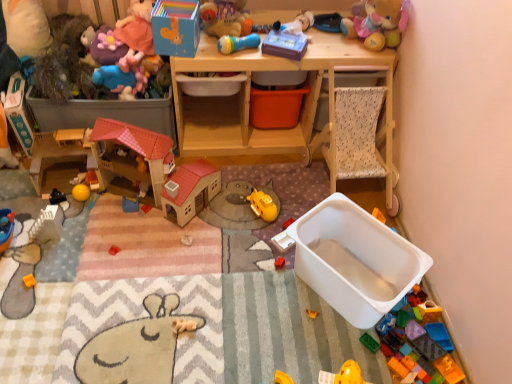
Question: From the image's perspective, is translucent plastic car at lower right, placed as the 1th toy when sorted from right to left, over wooden desk at upper center?

Choices:
 (A) no
 (B) yes

Answer: (A)

Question: Considering the relative sizes of translucent plastic car at lower right, placed as the 12th toy when sorted from left to right, and wooden desk at upper center in the image provided, is translucent plastic car at lower right, placed as the 12th toy when sorted from left to right, shorter than wooden desk at upper center?

Choices:
 (A) no
 (B) yes

Answer: (B)

Question: Are translucent plastic car at lower right, placed as the 1th toy when sorted from right to left, and wooden desk at upper center beside each other?

Choices:
 (A) no
 (B) yes

Answer: (A)

Question: Is translucent plastic car at lower right, placed as the 1th toy when sorted from right to left, closer to camera compared to wooden desk at upper center?

Choices:
 (A) yes
 (B) no

Answer: (A)

Question: Considering the relative sizes of translucent plastic car at lower right, placed as the 12th toy when sorted from left to right, and wooden desk at upper center in the image provided, is translucent plastic car at lower right, placed as the 12th toy when sorted from left to right, smaller than wooden desk at upper center?

Choices:
 (A) no
 (B) yes

Answer: (B)

Question: Is translucent plastic car at lower right, placed as the 1th toy when sorted from right to left, facing away from wooden desk at upper center?

Choices:
 (A) no
 (B) yes

Answer: (A)

Question: Could you tell me if rubberized plastic microphone at upper center, which is the eighth toy from left to right, is turned towards white plastic toy at center, arranged as the tenth toy when viewed from the left?

Choices:
 (A) no
 (B) yes

Answer: (A)

Question: From the image's perspective, is rubberized plastic microphone at upper center, which is the eighth toy from left to right, over white plastic toy at center, arranged as the third toy when viewed from the right?

Choices:
 (A) no
 (B) yes

Answer: (B)

Question: Is the depth of rubberized plastic microphone at upper center, which is counted as the fifth toy, starting from the right, less than that of white plastic toy at center, arranged as the third toy when viewed from the right?

Choices:
 (A) no
 (B) yes

Answer: (B)

Question: Would you say rubberized plastic microphone at upper center, which is the eighth toy from left to right, is outside white plastic toy at center, arranged as the third toy when viewed from the right?

Choices:
 (A) yes
 (B) no

Answer: (A)

Question: Can you confirm if rubberized plastic microphone at upper center, which is counted as the fifth toy, starting from the right, is thinner than white plastic toy at center, arranged as the third toy when viewed from the right?

Choices:
 (A) yes
 (B) no

Answer: (A)

Question: Is rubberized plastic microphone at upper center, which is counted as the fifth toy, starting from the right, further to camera compared to white plastic toy at center, arranged as the third toy when viewed from the right?

Choices:
 (A) yes
 (B) no

Answer: (B)

Question: Does matte blue rubber duck at upper left, which is counted as the 4th toy, starting from the left, appear on the right side of yellow rubber ball at center-left, the second toy positioned from the left?

Choices:
 (A) no
 (B) yes

Answer: (B)